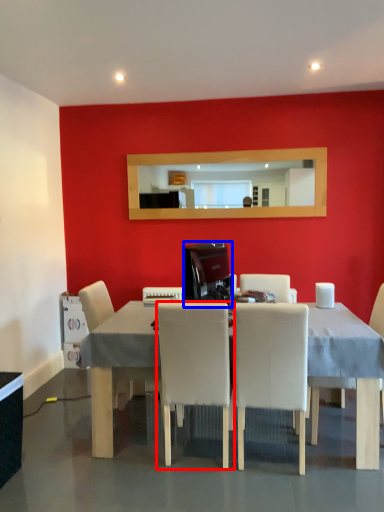
Question: Which object is further to the camera taking this photo, chair (highlighted by a red box) or appliance (highlighted by a blue box)?

Choices:
 (A) chair
 (B) appliance

Answer: (B)